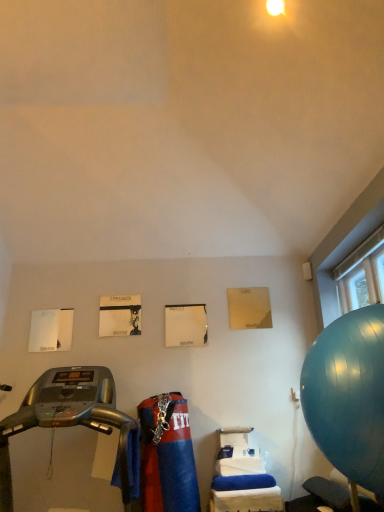
Question: Based on their sizes in the image, would you say blue rubber ball at right is bigger or smaller than silver metallic treadmill at left?

Choices:
 (A) big
 (B) small

Answer: (B)

Question: Considering the positions of blue rubber ball at right and silver metallic treadmill at left in the image, is blue rubber ball at right taller or shorter than silver metallic treadmill at left?

Choices:
 (A) short
 (B) tall

Answer: (A)

Question: From the image's perspective, is blue rubber ball at right positioned above or below silver metallic treadmill at left?

Choices:
 (A) above
 (B) below

Answer: (A)

Question: Considering the positions of point (3, 504) and point (360, 409), is point (3, 504) closer or farther from the camera than point (360, 409)?

Choices:
 (A) closer
 (B) farther

Answer: (B)

Question: Is silver metallic treadmill at left situated inside blue rubber ball at right or outside?

Choices:
 (A) outside
 (B) inside

Answer: (A)

Question: From a real-world perspective, is silver metallic treadmill at left positioned above or below blue rubber ball at right?

Choices:
 (A) above
 (B) below

Answer: (B)

Question: Considering their positions, is silver metallic treadmill at left located in front of or behind blue rubber ball at right?

Choices:
 (A) behind
 (B) front

Answer: (B)